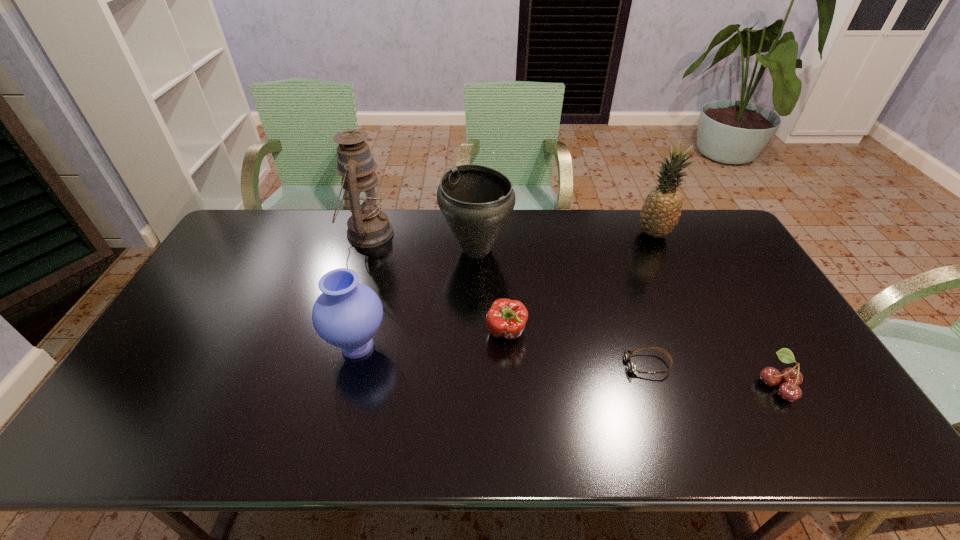
The width and height of the screenshot is (960, 540). What are the coordinates of `vacant area that satisfies the following two spatial constraints: 1. on the back side of the pepper; 2. on the right side of the vase` in the screenshot? It's located at (361, 333).